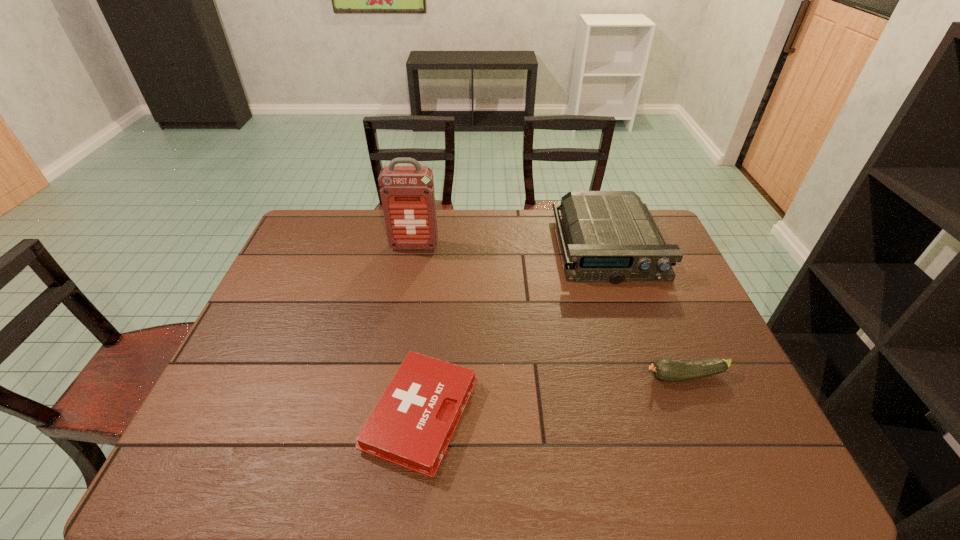
Identify the location of the taller first-aid kit. (407, 193).

Locate an element on the screen. The width and height of the screenshot is (960, 540). the tallest object is located at coordinates pos(407,193).

I want to click on the third shortest object, so click(x=612, y=237).

Locate an element on the screen. This screenshot has width=960, height=540. zucchini is located at coordinates (665, 369).

Find the location of a particular element. This screenshot has width=960, height=540. the nearer first-aid kit is located at coordinates (411, 426).

The image size is (960, 540). What are the coordinates of `vacant point located on the front-facing side of the farther first-aid kit` in the screenshot? It's located at (411, 262).

Locate an element on the screen. The image size is (960, 540). vacant area situated on the front panel of the radio receiver is located at coordinates (630, 309).

Find the location of a particular element. Image resolution: width=960 pixels, height=540 pixels. free spot located at the blossom end of the zucchini is located at coordinates tap(514, 376).

Locate an element on the screen. This screenshot has width=960, height=540. free location located 0.340m at the blossom end of the zucchini is located at coordinates (510, 376).

Locate an element on the screen. This screenshot has width=960, height=540. vacant area situated at the blossom end of the zucchini is located at coordinates (557, 376).